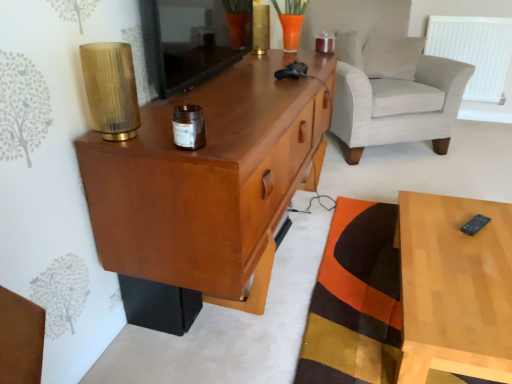
This screenshot has width=512, height=384. Find the location of `free spot to the right of brown glass jar at center, which appears as the first candle holder when viewed from the left`. free spot to the right of brown glass jar at center, which appears as the first candle holder when viewed from the left is located at coordinates (236, 139).